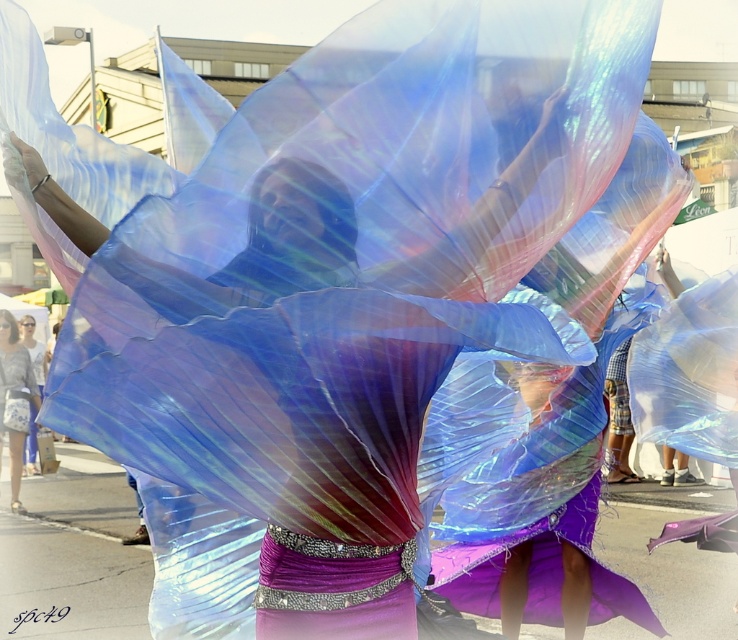
Question: Is iridescent fabric wings at center below matte gray shirt at lower left?

Choices:
 (A) yes
 (B) no

Answer: (B)

Question: Can you confirm if iridescent fabric wings at center is positioned above matte gray shirt at lower left?

Choices:
 (A) no
 (B) yes

Answer: (B)

Question: Does iridescent fabric wings at center appear on the left side of matte gray shirt at lower left?

Choices:
 (A) no
 (B) yes

Answer: (A)

Question: Which object appears farthest from the camera in this image?

Choices:
 (A) matte gray shirt at lower left
 (B) iridescent fabric wings at center

Answer: (A)